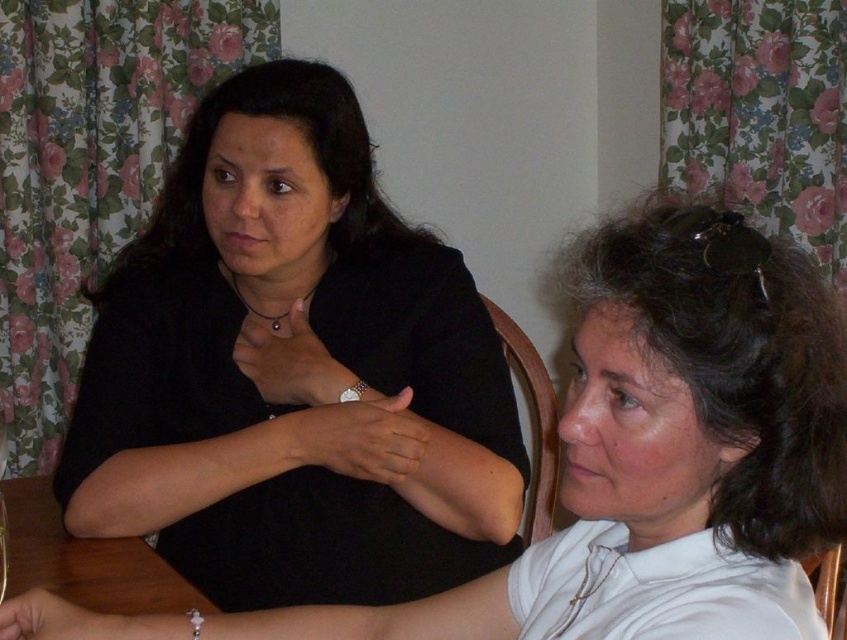
Who is more distant from viewer, (197, 513) or (126, 564)?

The point (197, 513) is behind.

Is matte black shirt at center positioned in front of brown wooden table at lower left?

No, matte black shirt at center is behind brown wooden table at lower left.

Is point (435, 428) farther from viewer compared to point (26, 512)?

No, it is not.

You are a GUI agent. You are given a task and a screenshot of the screen. Output one action in this format:
    pyautogui.click(x=<x>, y=<y>)
    Task: Click on the matte black shirt at center
    This screenshot has width=847, height=640.
    Given the screenshot: What is the action you would take?
    tap(292, 371)

Is matte black shirt at upper left taller than brown wooden table at lower left?

Yes.

Can you confirm if matte black shirt at upper left is thinner than brown wooden table at lower left?

In fact, matte black shirt at upper left might be wider than brown wooden table at lower left.

You are a GUI agent. You are given a task and a screenshot of the screen. Output one action in this format:
    pyautogui.click(x=<x>, y=<y>)
    Task: Click on the matte black shirt at upper left
    
    Given the screenshot: What is the action you would take?
    pyautogui.click(x=635, y=461)

Does matte black shirt at center come in front of matte black shirt at upper left?

No, it is not.

Is point (187, 524) positioned in front of point (787, 536)?

No.

Does point (261, 161) lie in front of point (782, 593)?

No, (261, 161) is behind (782, 593).

This screenshot has height=640, width=847. What are the coordinates of `matte black shirt at center` in the screenshot? It's located at (292, 371).